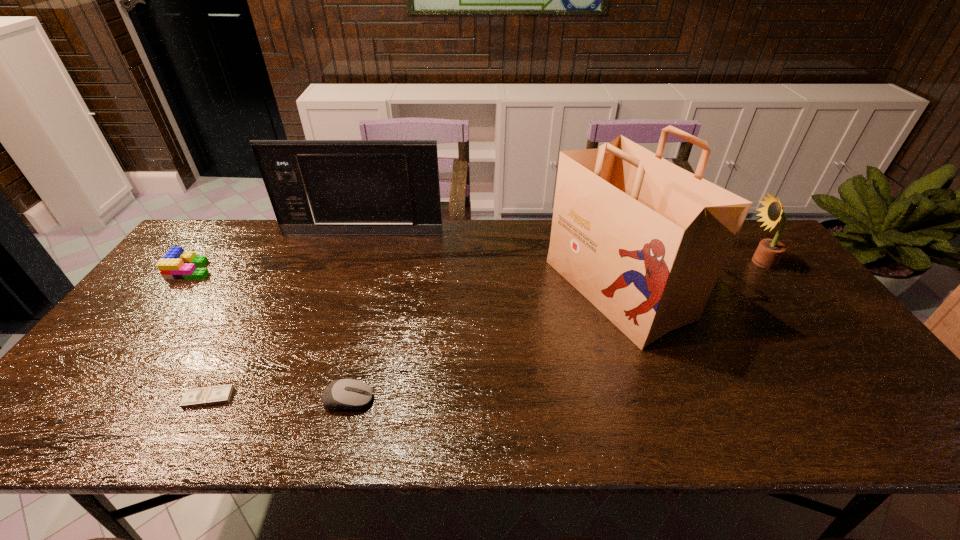
The height and width of the screenshot is (540, 960). I want to click on blank space at the far edge of the desktop, so click(x=278, y=249).

You are a GUI agent. You are given a task and a screenshot of the screen. Output one action in this format:
    pyautogui.click(x=<x>, y=<y>)
    Task: Click on the vacant region at the near edge of the desktop
    This screenshot has height=540, width=960.
    Given the screenshot: What is the action you would take?
    pyautogui.click(x=432, y=406)

The width and height of the screenshot is (960, 540). I want to click on vacant space at the left edge, so click(130, 326).

In the image, there is a desktop. At what (x,y) coordinates should I click in order to perform the action: click on free space at the right edge. Please return your answer as a coordinate pair (x, y). Looking at the image, I should click on (747, 272).

Image resolution: width=960 pixels, height=540 pixels. I want to click on vacant space at the far left corner of the desktop, so click(210, 244).

Identify the location of free space at the far right corner. Image resolution: width=960 pixels, height=540 pixels. (753, 249).

Where is `free space between the grocery bag and the second shortest object`? The height and width of the screenshot is (540, 960). free space between the grocery bag and the second shortest object is located at coordinates (483, 345).

Identify the location of free space between the money and the fourth shortest object. The image size is (960, 540). (484, 330).

Locate an element on the screen. This screenshot has height=540, width=960. free area in between the shortest object and the fifth tallest object is located at coordinates [278, 399].

Where is `free space between the computer equipment and the sunflower`? The image size is (960, 540). free space between the computer equipment and the sunflower is located at coordinates (554, 331).